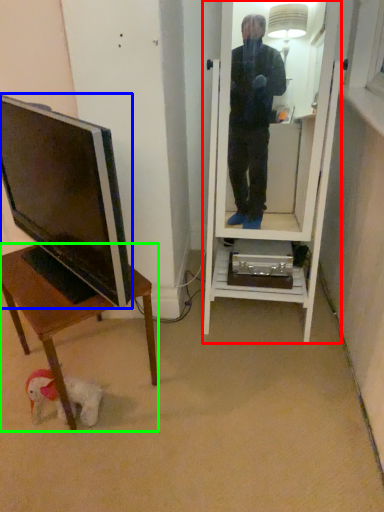
Question: Which object is the closest to the mirror (highlighted by a red box)? Choose among these: television (highlighted by a blue box) or desk (highlighted by a green box).

Choices:
 (A) television
 (B) desk

Answer: (B)